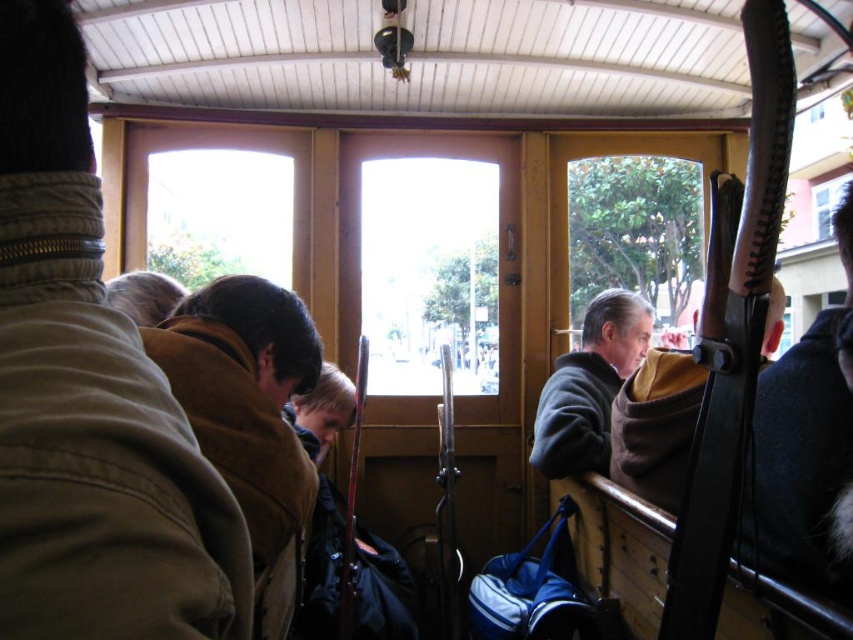
You are a passenger in the vintage tram and want to know if your small backpack can fit into the space between the brown leather jacket at upper left and the transparent glass window at upper right. Can you determine if it will fit?

The brown leather jacket at upper left is smaller than the transparent glass window at upper right, so the space between them may accommodate your small backpack. However, without knowing the exact dimensions of the backpack or the distance between the two objects, it is difficult to confirm with certainty.

You are a passenger in the vintage tram and you want to place your backpack on the seat next to you. There is a brown leather jacket at upper left on the seat. Can you place your backpack there?

The brown leather jacket at upper left is occupying the seat, so you cannot place your backpack there.

You are a passenger on a vintage tram. You notice a brown leather jacket at upper left and a transparent glass window at upper right. Which object is closer to the ceiling?

The transparent glass window at upper right is closer to the ceiling because it is taller than the brown leather jacket at upper left.